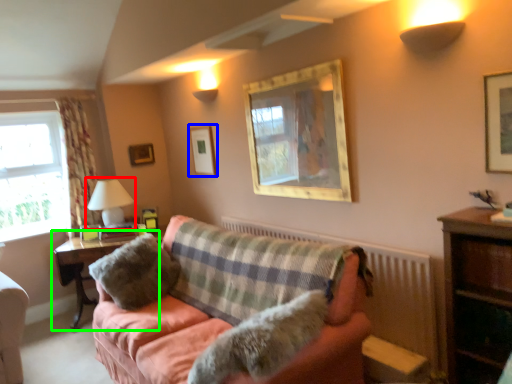
Question: Considering the real-world distances, which object is closest to table lamp (highlighted by a red box)? picture frame (highlighted by a blue box) or table (highlighted by a green box).

Choices:
 (A) picture frame
 (B) table

Answer: (B)